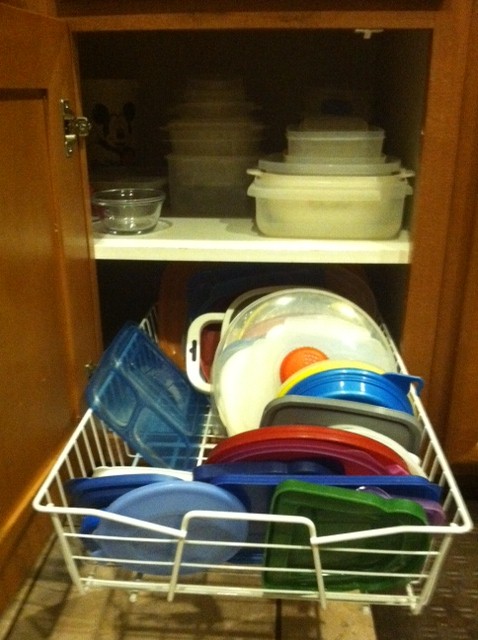
Locate an element on the screen. The image size is (478, 640). cabinet is located at coordinates 338,189, 340,152, 388,394, 361,408, 366,388, 375,381, 155,267, 168,70.